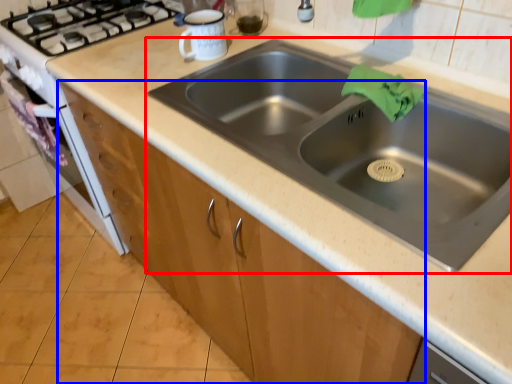
Question: Among these objects, which one is farthest to the camera, sink (highlighted by a red box) or cabinetry (highlighted by a blue box)?

Choices:
 (A) sink
 (B) cabinetry

Answer: (B)